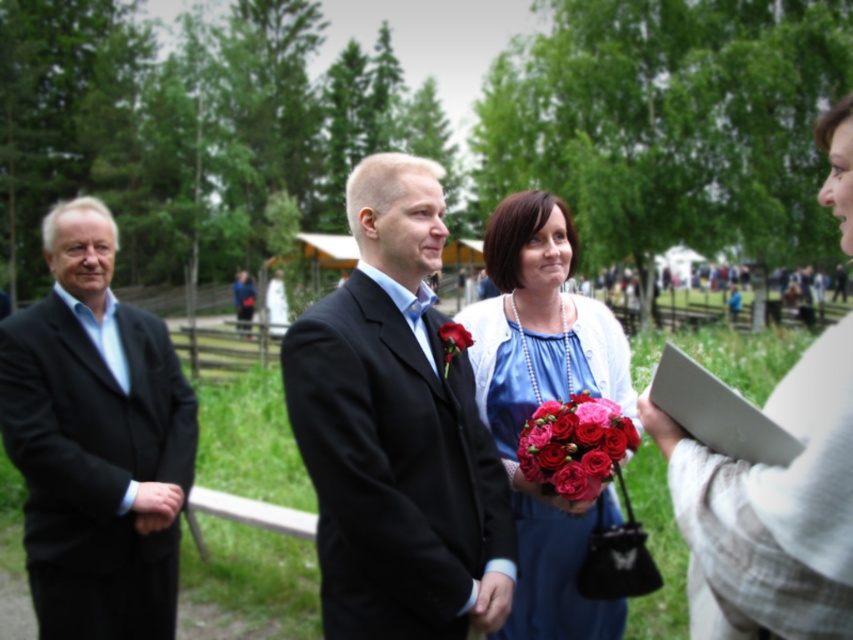
Is light beige sweater at right to the left of shiny red roses at center from the viewer's perspective?

No, light beige sweater at right is not to the left of shiny red roses at center.

Is point (833, 385) positioned after point (541, 404)?

No, (833, 385) is closer to viewer.

Who is more forward, (x=698, y=634) or (x=592, y=492)?

Point (x=698, y=634) is in front.

Where is `light beige sweater at right`? The height and width of the screenshot is (640, 853). light beige sweater at right is located at coordinates (770, 509).

Who is positioned more to the right, black matte suit at left or light beige sweater at right?

light beige sweater at right

Is black matte suit at left below light beige sweater at right?

Correct, black matte suit at left is located below light beige sweater at right.

The height and width of the screenshot is (640, 853). Identify the location of black matte suit at left. (96, 440).

Locate an element on the screen. Image resolution: width=853 pixels, height=640 pixels. black matte suit at left is located at coordinates (96, 440).

Based on the photo, is black matte suit at left wider than shiny red roses at center?

No.

Is black matte suit at left shorter than shiny red roses at center?

Incorrect, black matte suit at left's height does not fall short of shiny red roses at center's.

What do you see at coordinates (96, 440) in the screenshot? The width and height of the screenshot is (853, 640). I see `black matte suit at left` at bounding box center [96, 440].

Locate an element on the screen. black matte suit at left is located at coordinates [96, 440].